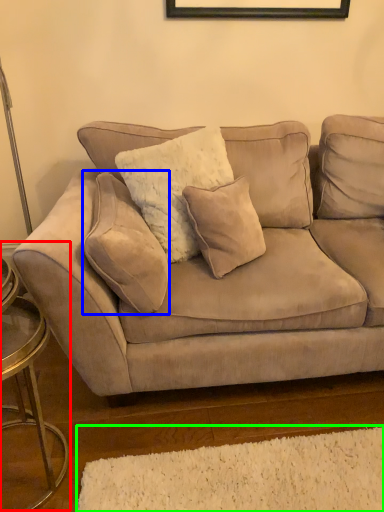
Question: Which object is the closest to the side table (highlighted by a red box)? Choose among these: pillow (highlighted by a blue box) or plain (highlighted by a green box).

Choices:
 (A) pillow
 (B) plain

Answer: (A)